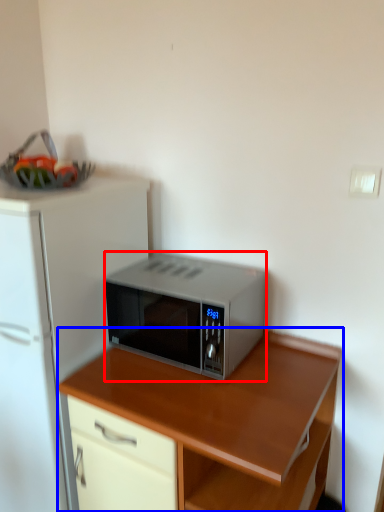
Question: Which of the following is the closest to the observer, microwave oven (highlighted by a red box) or desk (highlighted by a blue box)?

Choices:
 (A) microwave oven
 (B) desk

Answer: (B)